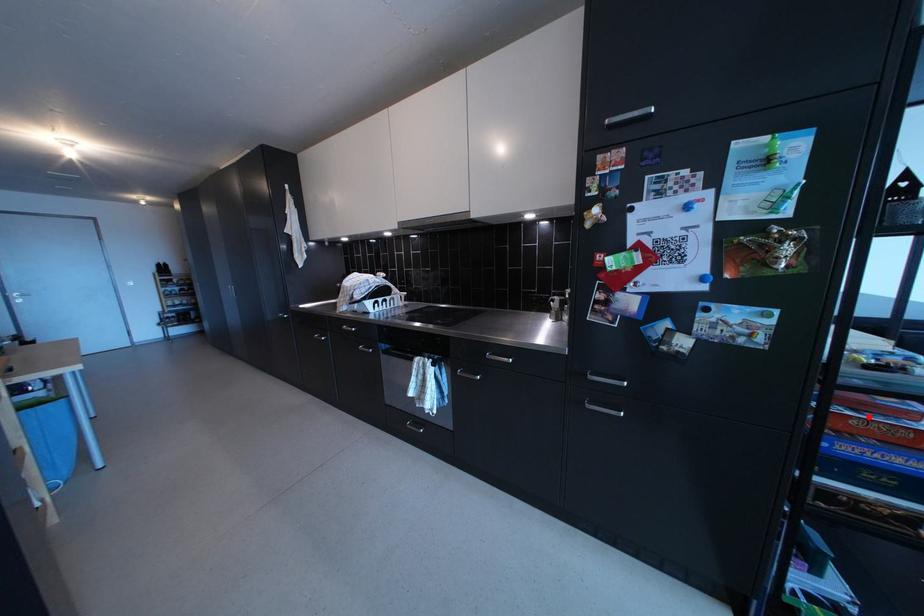
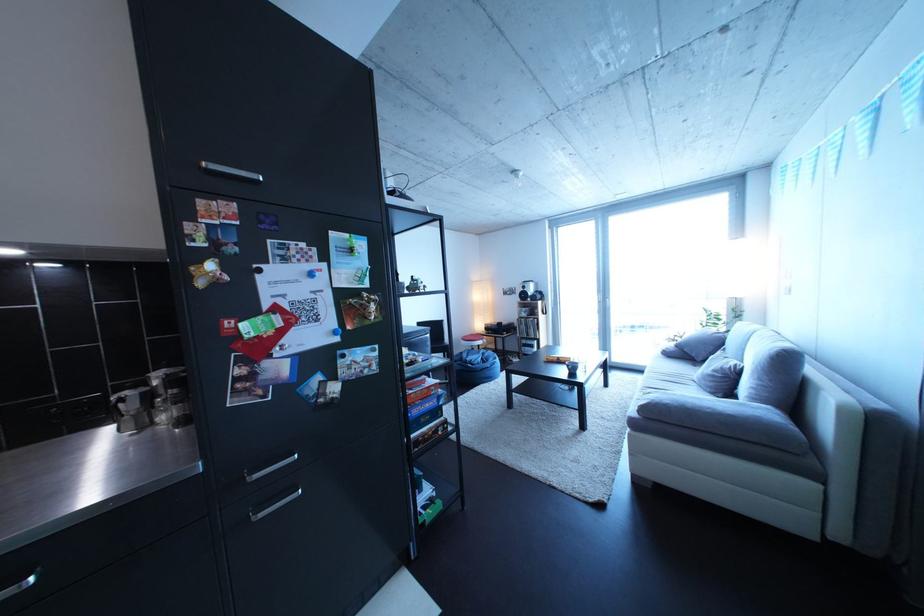
Question: I am providing you with two images of the same scene from different viewpoints. Given a red point in image1, look at the same physical point in image2. Is it:

Choices:
 (A) Closer to the viewpoint
 (B) Farther from the viewpoint

Answer: (B)